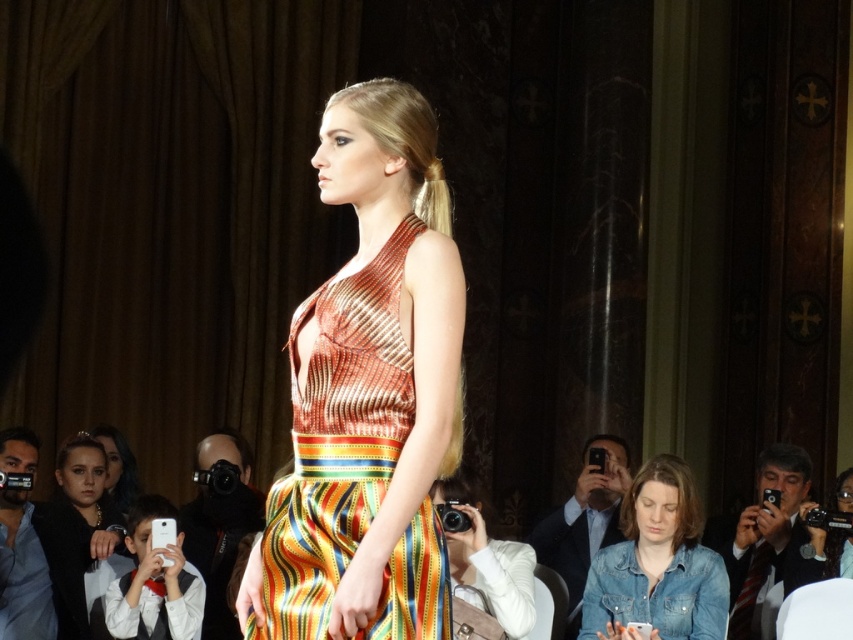
Which is below, metallic ribbed dress at center or denim jacket at lower right?

denim jacket at lower right is below.

Which of these two, metallic ribbed dress at center or denim jacket at lower right, stands shorter?

denim jacket at lower right is shorter.

Is point (369, 412) positioned after point (703, 632)?

No, (369, 412) is closer to viewer.

At what (x,y) coordinates should I click in order to perform the action: click on metallic ribbed dress at center. Please return your answer as a coordinate pair (x, y). This screenshot has width=853, height=640. Looking at the image, I should click on (337, 440).

Does denim jacket at lower right appear on the right side of matte black jacket at lower left?

Indeed, denim jacket at lower right is positioned on the right side of matte black jacket at lower left.

Does point (648, 499) come behind point (90, 456)?

No, it is in front of (90, 456).

Where is `denim jacket at lower right`? This screenshot has height=640, width=853. denim jacket at lower right is located at coordinates (657, 564).

Can you confirm if matte black jacket at lower left is bigger than matte black hair at lower left?

Yes, matte black jacket at lower left is bigger than matte black hair at lower left.

Does matte black jacket at lower left appear on the left side of matte black hair at lower left?

Correct, you'll find matte black jacket at lower left to the left of matte black hair at lower left.

The width and height of the screenshot is (853, 640). What are the coordinates of `matte black jacket at lower left` in the screenshot? It's located at (77, 531).

Where is `matte black jacket at lower left`? The height and width of the screenshot is (640, 853). matte black jacket at lower left is located at coordinates (77, 531).